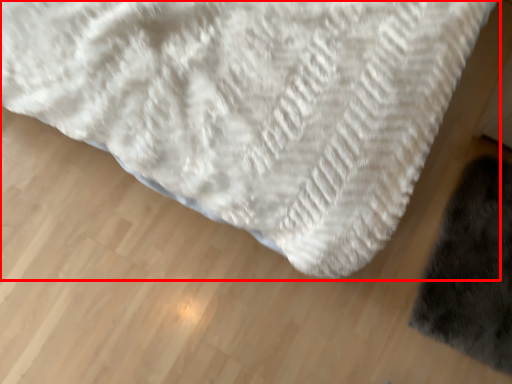
Question: In this image, where is towel (annotated by the red box) located relative to mat?

Choices:
 (A) left
 (B) right

Answer: (A)